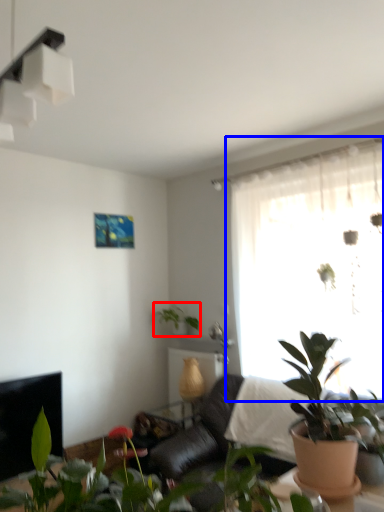
Question: Which of the following is the farthest to the observer, houseplant (highlighted by a red box) or window (highlighted by a blue box)?

Choices:
 (A) houseplant
 (B) window

Answer: (A)